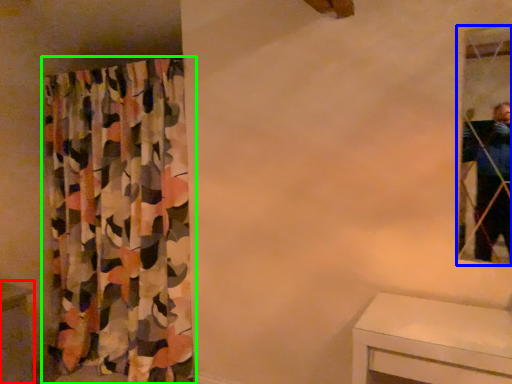
Question: Which is nearer to the vanity (highlighted by a red box)? mirror (highlighted by a blue box) or curtain (highlighted by a green box).

Choices:
 (A) mirror
 (B) curtain

Answer: (B)